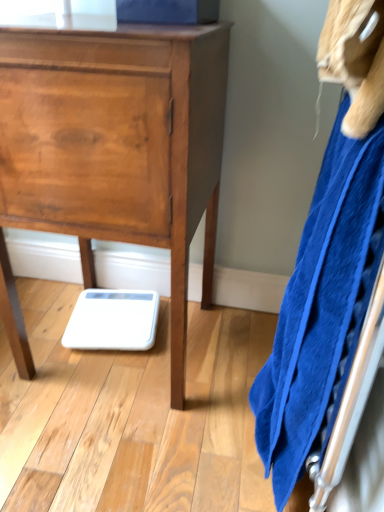
Question: From a real-world perspective, is wooden chest of drawers at center on blue soft towel at right?

Choices:
 (A) no
 (B) yes

Answer: (A)

Question: Considering the relative positions of wooden chest of drawers at center and blue soft towel at right in the image provided, is wooden chest of drawers at center behind blue soft towel at right?

Choices:
 (A) yes
 (B) no

Answer: (A)

Question: Is wooden chest of drawers at center at the left side of blue soft towel at right?

Choices:
 (A) yes
 (B) no

Answer: (A)

Question: From the image's perspective, does wooden chest of drawers at center appear higher than blue soft towel at right?

Choices:
 (A) no
 (B) yes

Answer: (B)

Question: Is wooden chest of drawers at center touching blue soft towel at right?

Choices:
 (A) no
 (B) yes

Answer: (A)

Question: From the image's perspective, is wooden chest of drawers at center beneath blue soft towel at right?

Choices:
 (A) yes
 (B) no

Answer: (B)

Question: Is wooden chest of drawers at center at the back of blue soft towel at right?

Choices:
 (A) yes
 (B) no

Answer: (B)

Question: Is blue soft towel at right at the left side of wooden chest of drawers at center?

Choices:
 (A) no
 (B) yes

Answer: (A)

Question: Is the depth of blue soft towel at right less than that of wooden chest of drawers at center?

Choices:
 (A) no
 (B) yes

Answer: (B)

Question: Could you tell me if blue soft towel at right is turned towards wooden chest of drawers at center?

Choices:
 (A) yes
 (B) no

Answer: (A)

Question: Is blue soft towel at right completely or partially outside of wooden chest of drawers at center?

Choices:
 (A) no
 (B) yes

Answer: (B)

Question: From the image's perspective, would you say blue soft towel at right is positioned over wooden chest of drawers at center?

Choices:
 (A) no
 (B) yes

Answer: (A)

Question: Is point (26, 163) closer or farther from the camera than point (283, 354)?

Choices:
 (A) closer
 (B) farther

Answer: (B)